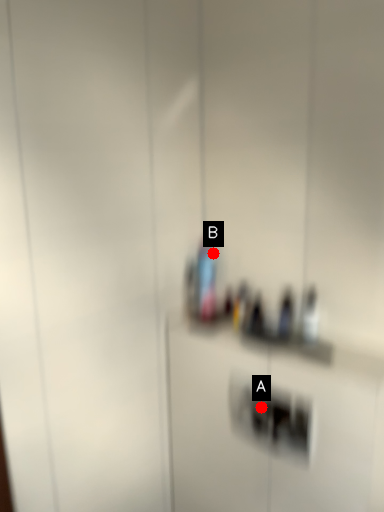
Question: Two points are circled on the image, labeled by A and B beside each circle. Which point is closer to the camera?

Choices:
 (A) A is closer
 (B) B is closer

Answer: (A)